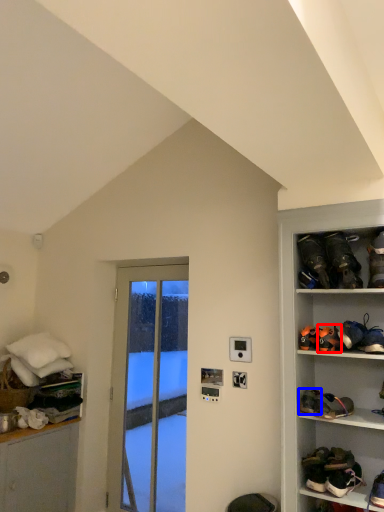
Question: Which of the following is the farthest to the observer, footwear (highlighted by a red box) or footwear (highlighted by a blue box)?

Choices:
 (A) footwear
 (B) footwear

Answer: (A)